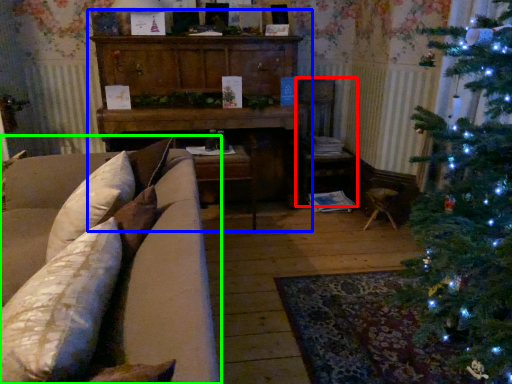
Question: Based on their relative distances, which object is farther from armchair (highlighted by a red box)? Choose from dresser (highlighted by a blue box) and studio couch (highlighted by a green box).

Choices:
 (A) dresser
 (B) studio couch

Answer: (B)